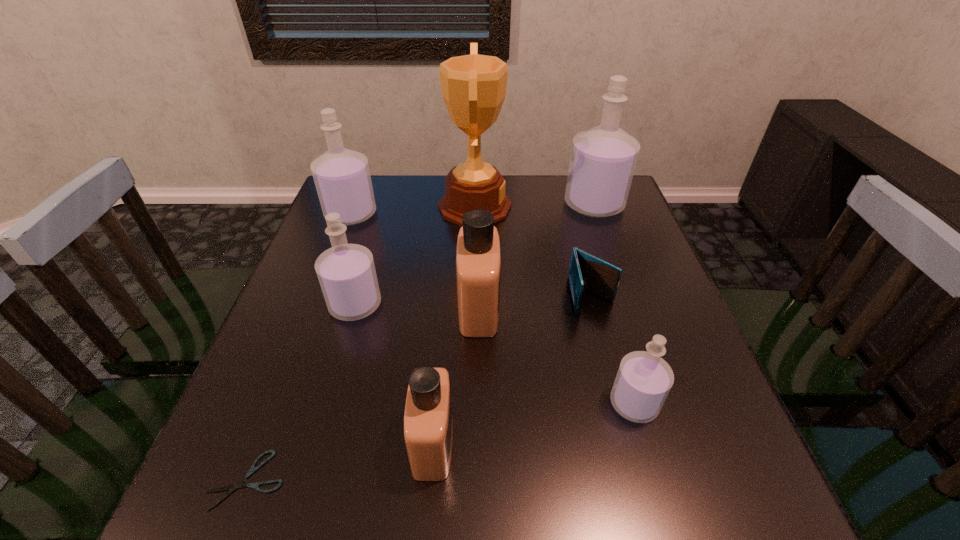
Locate an element on the screen. This screenshot has height=540, width=960. blank space at the near edge is located at coordinates (649, 521).

Identify the location of free spot at the left edge of the desktop. (302, 299).

What are the coordinates of `blank space at the right edge` in the screenshot? It's located at (695, 404).

The image size is (960, 540). I want to click on blank space at the near right corner, so click(x=714, y=481).

Find the location of a particular element. empty space between the smallest purple perfume and the biggest purple perfume is located at coordinates (614, 304).

Where is `unoccupied position between the third smallest purple perfume and the bigger beige perfume`? unoccupied position between the third smallest purple perfume and the bigger beige perfume is located at coordinates (415, 261).

Find the location of a particular element. Image resolution: width=960 pixels, height=540 pixels. free space between the nearest purple perfume and the smaller beige perfume is located at coordinates (534, 423).

Where is `vacant region between the third biggest purple perfume and the nearest purple perfume`? vacant region between the third biggest purple perfume and the nearest purple perfume is located at coordinates (494, 354).

Find the location of `empty space that is in between the award and the smaller beige perfume`. empty space that is in between the award and the smaller beige perfume is located at coordinates (454, 325).

You are a GUI agent. You are given a task and a screenshot of the screen. Output one action in this format:
    pyautogui.click(x=<x>, y=<y>)
    Task: Click on the empty space between the biggest purple perfume and the smaller beige perfume
    This screenshot has width=960, height=540.
    Given the screenshot: What is the action you would take?
    click(x=514, y=323)